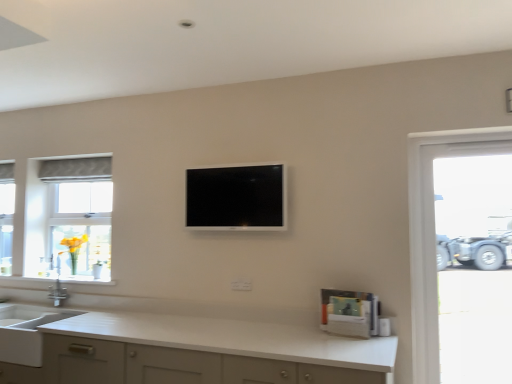
Question: Is point (75, 261) closer or farther from the camera than point (279, 382)?

Choices:
 (A) closer
 (B) farther

Answer: (B)

Question: Based on their positions, is yellow glass vase at left located to the left or right of white matte countertop at lower center?

Choices:
 (A) left
 (B) right

Answer: (A)

Question: Based on their relative distances, which object is nearer to the transparent glass door at right?

Choices:
 (A) silver metallic faucet at left
 (B) black glossy tv at center
 (C) matte gray fabric at left
 (D) white matte countertop at lower center
 (E) yellow glass vase at left

Answer: (B)

Question: Considering the real-world distances, which object is closest to the black glossy tv at center?

Choices:
 (A) white matte sink at lower left
 (B) silver metallic faucet at left
 (C) white matte countertop at lower center
 (D) matte gray fabric at left
 (E) yellow glass vase at left

Answer: (C)